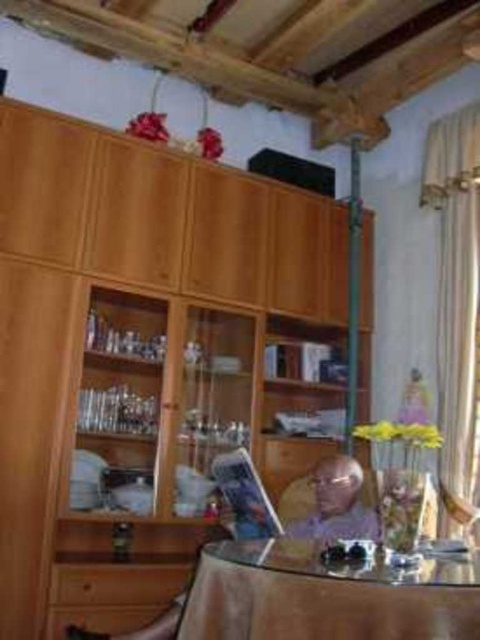
Question: Which point is closer to the camera taking this photo?

Choices:
 (A) (316, 486)
 (B) (350, 611)

Answer: (B)

Question: Is transparent glass table at center closer to the viewer compared to light purple fabric at center?

Choices:
 (A) no
 (B) yes

Answer: (B)

Question: Is transparent glass table at center below light purple fabric at center?

Choices:
 (A) no
 (B) yes

Answer: (B)

Question: Does transparent glass table at center appear on the right side of light purple fabric at center?

Choices:
 (A) yes
 (B) no

Answer: (A)

Question: Which of the following is the closest to the observer?

Choices:
 (A) (357, 531)
 (B) (325, 570)

Answer: (B)